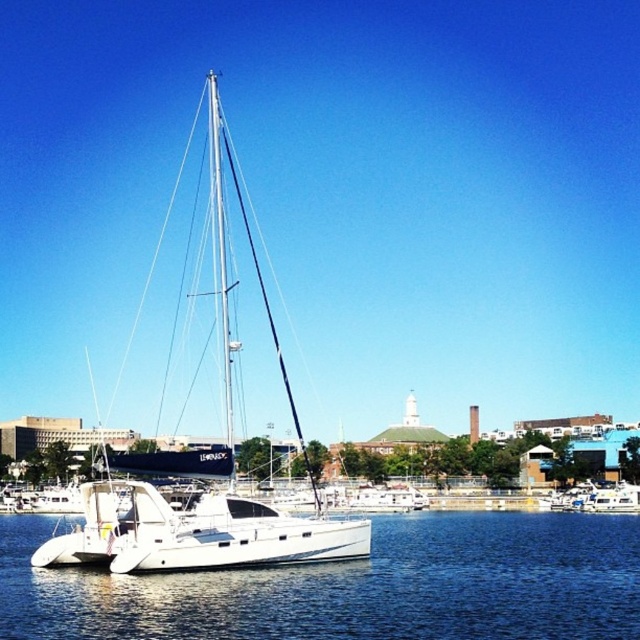
Question: Which of the following is the closest to the observer?

Choices:
 (A) clear blue water at center
 (B) white glossy sailboat at center

Answer: (A)

Question: In this image, where is clear blue water at center located relative to white glossy sailboat at center?

Choices:
 (A) right
 (B) left

Answer: (A)

Question: Among these objects, which one is nearest to the camera?

Choices:
 (A) clear blue water at center
 (B) white glossy sailboat at center

Answer: (A)

Question: Which point is closer to the camera?

Choices:
 (A) white glossy sailboat at center
 (B) clear blue water at center

Answer: (B)

Question: Is clear blue water at center further to the viewer compared to white glossy sailboat at center?

Choices:
 (A) no
 (B) yes

Answer: (A)

Question: Can you confirm if clear blue water at center is bigger than white glossy sailboat at center?

Choices:
 (A) no
 (B) yes

Answer: (A)